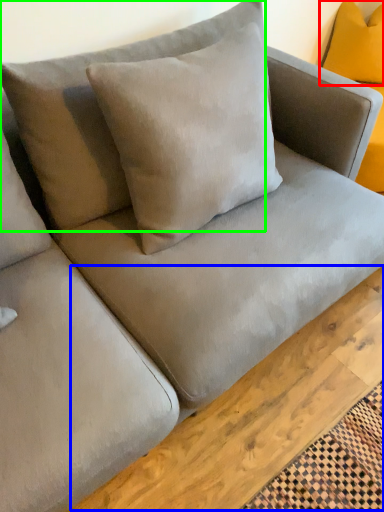
Question: Which object is the farthest from pillow (highlighted by a red box)? Choose among these: plank (highlighted by a blue box) or pillow (highlighted by a green box).

Choices:
 (A) plank
 (B) pillow

Answer: (A)